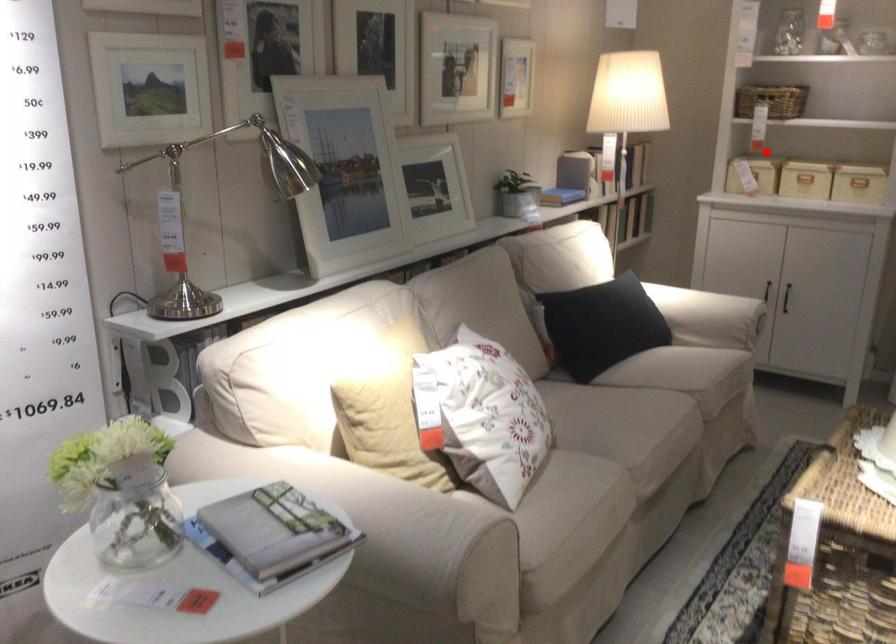
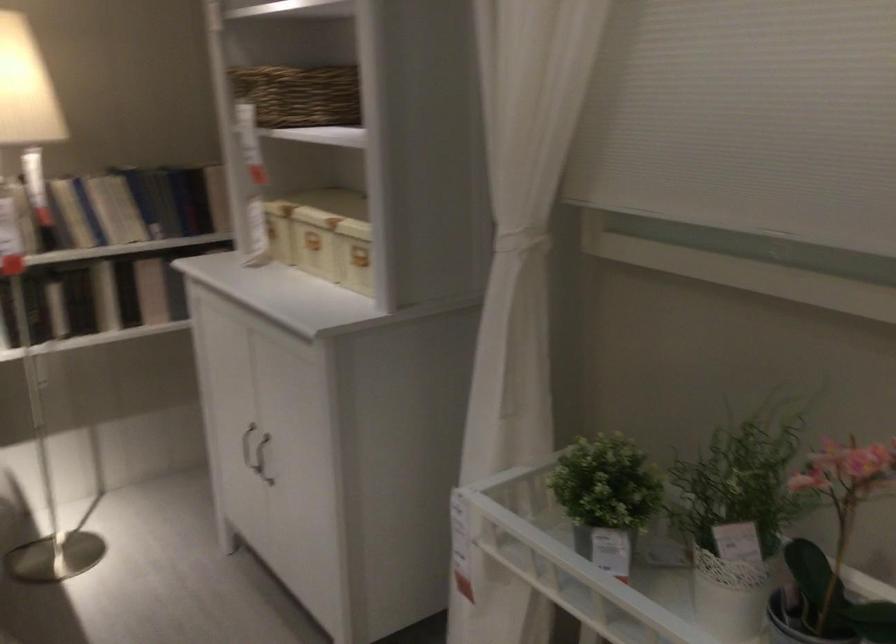
Locate, in the second image, the point that corresponds to the highlighted location in the first image.

(270, 230)